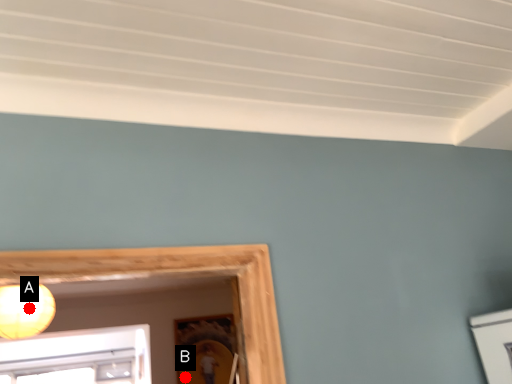
Question: Two points are circled on the image, labeled by A and B beside each circle. Among these points, which one is farthest from the camera?

Choices:
 (A) A is further
 (B) B is further

Answer: (B)